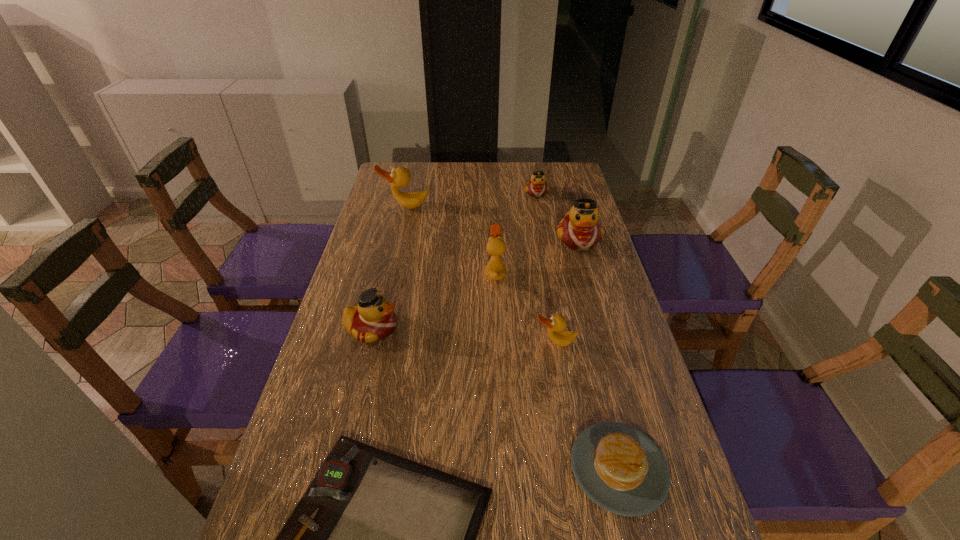
The height and width of the screenshot is (540, 960). Find the location of `the fifth closest duck to the leftmost red duck`. the fifth closest duck to the leftmost red duck is located at coordinates (537, 187).

You are a GUI agent. You are given a task and a screenshot of the screen. Output one action in this format:
    pyautogui.click(x=<x>, y=<y>)
    Task: Click on the red duck that is the second closest one to the smallest tan duck
    This screenshot has height=540, width=960.
    Given the screenshot: What is the action you would take?
    pyautogui.click(x=373, y=319)

Identify which red duck is located as the nearest to the shortest object. Please provide its 2D coordinates. Your answer should be formatted as a tuple, i.e. [(x, y)], where the tuple contains the x and y coordinates of a point satisfying the conditions above.

[(373, 319)]

This screenshot has width=960, height=540. Find the location of `tan duck that can be found as the second closest to the second smallest red duck`. tan duck that can be found as the second closest to the second smallest red duck is located at coordinates (556, 324).

Locate an element on the screen. Image resolution: width=960 pixels, height=540 pixels. tan duck that is the third closest to the shortest object is located at coordinates (399, 177).

You are a GUI agent. You are given a task and a screenshot of the screen. Output one action in this format:
    pyautogui.click(x=<x>, y=<y>)
    Task: Click on the vacant area that satisfies the following two spatial constraints: 1. on the beak of the rightmost tan duck; 2. on the left side of the pancake
    The image size is (960, 540).
    Given the screenshot: What is the action you would take?
    pyautogui.click(x=576, y=468)

I want to click on blank space that satisfies the following two spatial constraints: 1. on the beak of the fourth farthest duck; 2. on the right side of the second shortest object, so click(x=503, y=468).

At what (x,y) coordinates should I click in order to perform the action: click on vacant point that satisfies the following two spatial constraints: 1. on the face of the farthest duck; 2. on the face of the nearest red duck. Please return your answer as a coordinate pair (x, y). Looking at the image, I should click on (563, 329).